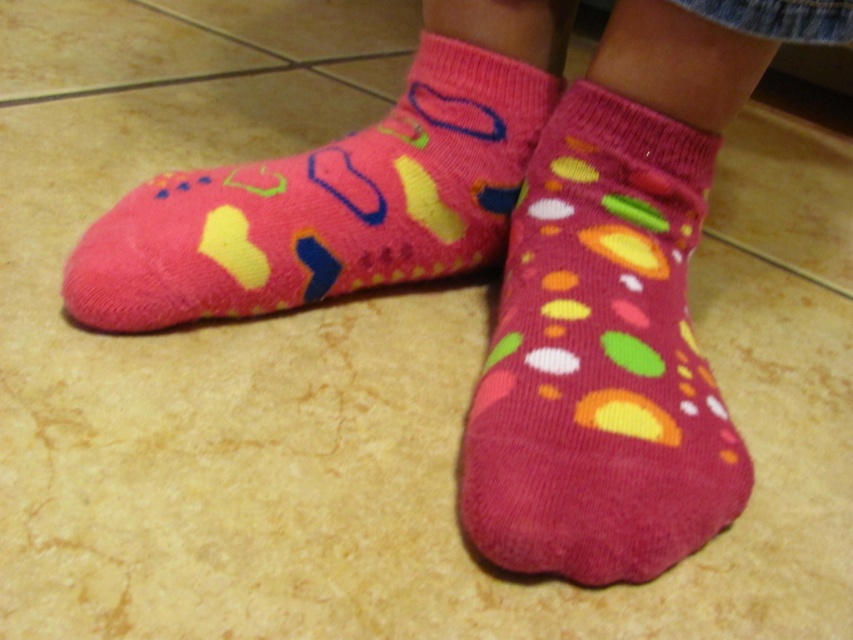
Question: Which point is farther to the camera?

Choices:
 (A) (637, 282)
 (B) (155, 275)

Answer: (A)

Question: Among these points, which one is farthest from the camera?

Choices:
 (A) (361, 211)
 (B) (621, 371)

Answer: (A)

Question: Does pink soft socks at center have a larger size compared to pink fuzzy socks at left?

Choices:
 (A) yes
 (B) no

Answer: (B)

Question: Does pink soft socks at center have a greater width compared to pink fuzzy socks at left?

Choices:
 (A) no
 (B) yes

Answer: (A)

Question: Does pink soft socks at center appear over pink fuzzy socks at left?

Choices:
 (A) yes
 (B) no

Answer: (B)

Question: Which point is closer to the camera taking this photo?

Choices:
 (A) (303, 196)
 (B) (711, 376)

Answer: (B)